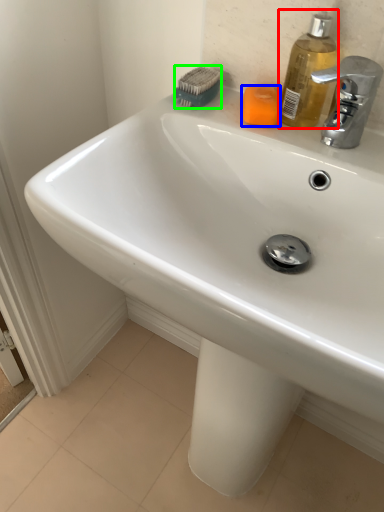
Question: Which object is positioned farthest from soap dispenser (highlighted by a red box)? Select from soap (highlighted by a blue box) and brush (highlighted by a green box).

Choices:
 (A) soap
 (B) brush

Answer: (B)